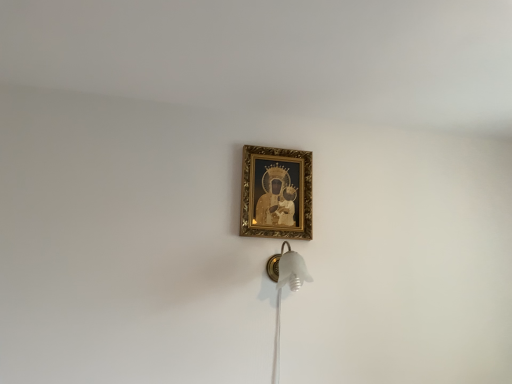
The image size is (512, 384). Identify the location of gold ornate frame at upper center. (276, 192).

What is the approximate width of gold ornate frame at upper center?

It is 4.18 centimeters.

The height and width of the screenshot is (384, 512). What do you see at coordinates (276, 192) in the screenshot? I see `gold ornate frame at upper center` at bounding box center [276, 192].

Where is `gold ornate frame at upper center`? Image resolution: width=512 pixels, height=384 pixels. gold ornate frame at upper center is located at coordinates (276, 192).